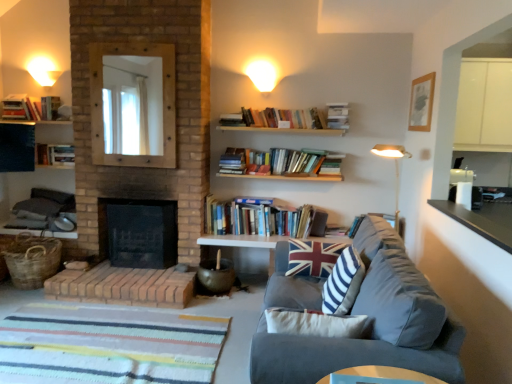
Question: In the image, is hardcover book at upper center, which is the 3th book in top-to-bottom order, on the left side or the right side of union jack fabric pillow at center, the 2th pillow positioned from the front?

Choices:
 (A) left
 (B) right

Answer: (B)

Question: Considering the positions of hardcover book at upper center, the third book from the bottom, and union jack fabric pillow at center, the 2th pillow positioned from the front, in the image, is hardcover book at upper center, the third book from the bottom, bigger or smaller than union jack fabric pillow at center, the 2th pillow positioned from the front,?

Choices:
 (A) big
 (B) small

Answer: (B)

Question: Based on their relative distances, which object is nearer to the smooth wooden table at lower center?

Choices:
 (A) hardcover book at upper left, which is the third book from left to right
 (B) white matte wall sconce at upper left, which ranks as the second lighting in right-to-left order
 (C) hardcover books at left, which is the second book from bottom to top
 (D) velvet gray couch at lower right
 (E) hardcover book at upper center, which is the 3th book in top-to-bottom order

Answer: (D)

Question: Estimate the real-world distances between objects in this image. Which object is closer to the hardcover book at upper center, acting as the fifth book starting from the left?

Choices:
 (A) black laminate countertop at right
 (B) hardcover book at upper left, positioned as the 3th book in right-to-left order
 (C) white matte lampshade at upper center, the 2th lighting when ordered from left to right
 (D) striped fabric pillow at center, acting as the 1th pillow starting from the front
 (E) black brick fireplace at center

Answer: (C)